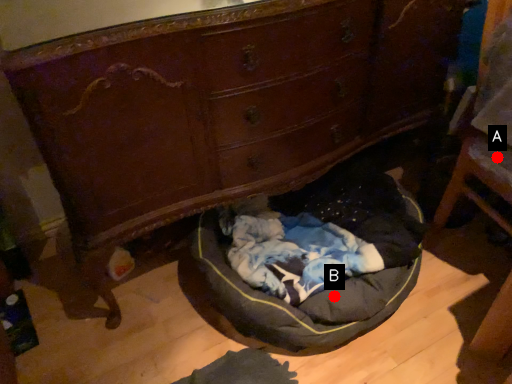
Question: Two points are circled on the image, labeled by A and B beside each circle. Which of the following is the farthest from the observer?

Choices:
 (A) A is further
 (B) B is further

Answer: (B)